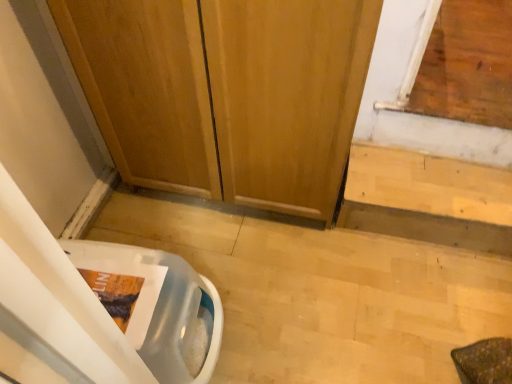
You are a GUI agent. You are given a task and a screenshot of the screen. Output one action in this format:
    pyautogui.click(x=<x>, y=<y>)
    Task: Click on the translucent plastic toilet bowl at lower left
    
    Given the screenshot: What is the action you would take?
    pyautogui.click(x=160, y=305)

Identify the location of light wood stairs at lower right. The width and height of the screenshot is (512, 384). (428, 199).

Is translucent plastic toilet bowl at lower left beside light wood stairs at lower right?

No, translucent plastic toilet bowl at lower left is not making contact with light wood stairs at lower right.

Can you confirm if translucent plastic toilet bowl at lower left is wider than light wood stairs at lower right?

Correct, the width of translucent plastic toilet bowl at lower left exceeds that of light wood stairs at lower right.

Is translucent plastic toilet bowl at lower left behind light wood stairs at lower right?

No, translucent plastic toilet bowl at lower left is closer to the viewer.

From the image's perspective, between translucent plastic toilet bowl at lower left and light wood stairs at lower right, who is located below?

translucent plastic toilet bowl at lower left, from the image's perspective.

From the image's perspective, is light wood stairs at lower right located above or below translucent plastic toilet bowl at lower left?

Clearly, from the image's perspective, light wood stairs at lower right is above translucent plastic toilet bowl at lower left.

Which object is wider, light wood stairs at lower right or translucent plastic toilet bowl at lower left?

translucent plastic toilet bowl at lower left is wider.

Locate an element on the screen. toilet bowl lying on the left of light wood stairs at lower right is located at coordinates (160, 305).

Could you measure the distance between light wood stairs at lower right and translucent plastic toilet bowl at lower left?

light wood stairs at lower right is 30.35 inches from translucent plastic toilet bowl at lower left.

Does light wood stairs at lower right touch wooden door at center?

No, light wood stairs at lower right is not with wooden door at center.

Does point (447, 197) appear closer or farther from the camera than point (246, 133)?

Point (447, 197).

Which is in front, light wood stairs at lower right or wooden door at center?

wooden door at center is closer to the camera.

From a real-world perspective, which is physically above, light wood stairs at lower right or wooden door at center?

wooden door at center, from a real-world perspective.

Considering the relative positions of wooden door at center and translucent plastic toilet bowl at lower left in the image provided, is wooden door at center to the right of translucent plastic toilet bowl at lower left from the viewer's perspective?

Correct, you'll find wooden door at center to the right of translucent plastic toilet bowl at lower left.

I want to click on door that appears above the translucent plastic toilet bowl at lower left (from the image's perspective), so click(284, 96).

Looking at this image, from the image's perspective, which one is positioned higher, wooden door at center or translucent plastic toilet bowl at lower left?

wooden door at center is shown above in the image.

Considering the sizes of objects wooden door at center and translucent plastic toilet bowl at lower left in the image provided, who is shorter, wooden door at center or translucent plastic toilet bowl at lower left?

With less height is translucent plastic toilet bowl at lower left.

From the image's perspective, which one is positioned higher, translucent plastic toilet bowl at lower left or wooden door at center?

wooden door at center appears higher in the image.

Which is behind, point (201, 371) or point (295, 130)?

Positioned behind is point (295, 130).

From a real-world perspective, which is physically below, translucent plastic toilet bowl at lower left or wooden door at center?

translucent plastic toilet bowl at lower left, from a real-world perspective.

Who is bigger, translucent plastic toilet bowl at lower left or wooden door at center?

With larger size is wooden door at center.

Is the position of wooden door at center less distant than that of light wood stairs at lower right?

That is True.

Are wooden door at center and light wood stairs at lower right located far from each other?

No, wooden door at center is not far from light wood stairs at lower right.

Does point (275, 89) lie behind point (504, 231)?

No, it is in front of (504, 231).

Considering the relative positions of wooden door at center and light wood stairs at lower right in the image provided, is wooden door at center to the left of light wood stairs at lower right from the viewer's perspective?

Indeed, wooden door at center is positioned on the left side of light wood stairs at lower right.

Locate an element on the screen. stairwell that appears below the translucent plastic toilet bowl at lower left (from a real-world perspective) is located at coordinates (428, 199).

Find the location of `toilet bowl above the light wood stairs at lower right (from a real-world perspective)`. toilet bowl above the light wood stairs at lower right (from a real-world perspective) is located at coordinates (160, 305).

Based on their spatial positions, is light wood stairs at lower right or wooden door at center closer to translucent plastic toilet bowl at lower left?

wooden door at center.

Considering their positions, is wooden door at center positioned closer to light wood stairs at lower right than translucent plastic toilet bowl at lower left?

wooden door at center is closer to light wood stairs at lower right.

Looking at the image, which one is located further to wooden door at center, translucent plastic toilet bowl at lower left or light wood stairs at lower right?

Based on the image, translucent plastic toilet bowl at lower left appears to be further to wooden door at center.

When comparing their distances from light wood stairs at lower right, does translucent plastic toilet bowl at lower left or wooden door at center seem further?

Based on the image, translucent plastic toilet bowl at lower left appears to be further to light wood stairs at lower right.

Considering their positions, is wooden door at center positioned closer to translucent plastic toilet bowl at lower left than light wood stairs at lower right?

Among the two, wooden door at center is located nearer to translucent plastic toilet bowl at lower left.

Estimate the real-world distances between objects in this image. Which object is closer to wooden door at center, light wood stairs at lower right or translucent plastic toilet bowl at lower left?

Among the two, light wood stairs at lower right is located nearer to wooden door at center.

Find the location of a particular element. The height and width of the screenshot is (384, 512). door located between translucent plastic toilet bowl at lower left and light wood stairs at lower right in the left-right direction is located at coordinates (284, 96).